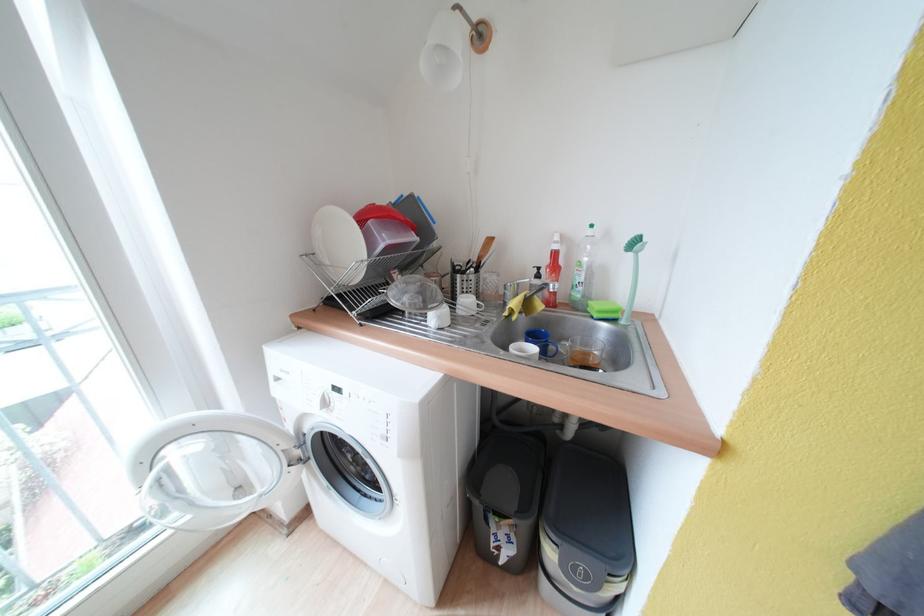
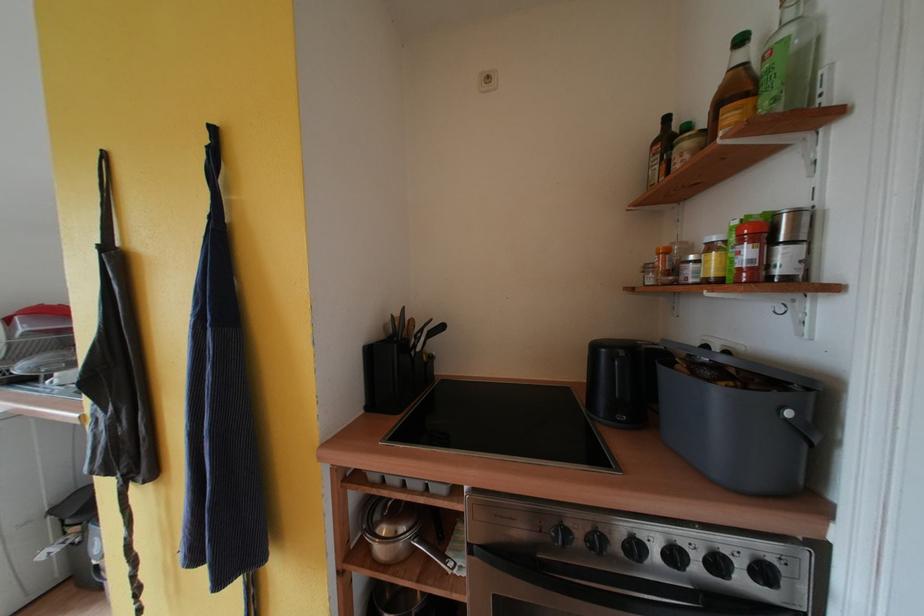
Where in the second image is the point corresponding to point 527,515 from the first image?

(83, 517)